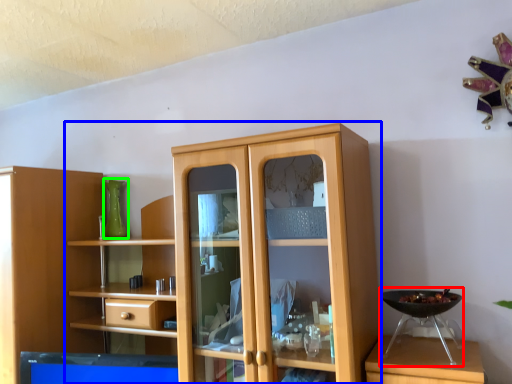
Question: Which object is the closest to the appliance (highlighted by a red box)? Choose among these: cupboard (highlighted by a blue box) or glass vase (highlighted by a green box).

Choices:
 (A) cupboard
 (B) glass vase

Answer: (A)